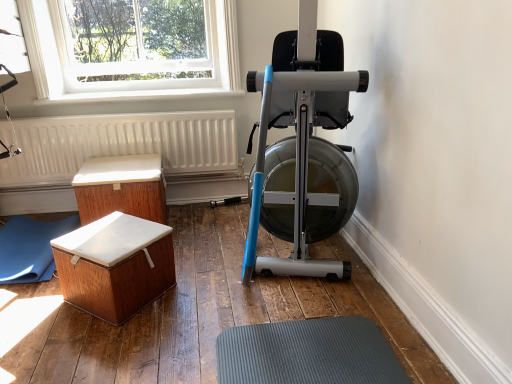
Question: Does wooden chest at lower left, which ranks as the 1th furniture in front-to-back order, come behind silver metallic stationary bicycle at center?

Choices:
 (A) no
 (B) yes

Answer: (B)

Question: Does wooden chest at lower left, which ranks as the 1th furniture in front-to-back order, have a greater width compared to silver metallic stationary bicycle at center?

Choices:
 (A) yes
 (B) no

Answer: (B)

Question: From the image's perspective, is wooden chest at lower left, marked as the 2th furniture in a back-to-front arrangement, on top of silver metallic stationary bicycle at center?

Choices:
 (A) no
 (B) yes

Answer: (A)

Question: Considering the relative positions of wooden chest at lower left, which ranks as the 1th furniture in front-to-back order, and silver metallic stationary bicycle at center in the image provided, is wooden chest at lower left, which ranks as the 1th furniture in front-to-back order, to the left of silver metallic stationary bicycle at center from the viewer's perspective?

Choices:
 (A) no
 (B) yes

Answer: (B)

Question: Can you confirm if wooden chest at lower left, which ranks as the 1th furniture in front-to-back order, is smaller than silver metallic stationary bicycle at center?

Choices:
 (A) yes
 (B) no

Answer: (A)

Question: From their relative heights in the image, would you say wooden chest at lower left, which ranks as the 1th furniture in front-to-back order, is taller or shorter than white textured radiator at lower left?

Choices:
 (A) short
 (B) tall

Answer: (A)

Question: Relative to white textured radiator at lower left, is wooden chest at lower left, marked as the 2th furniture in a back-to-front arrangement, in front or behind?

Choices:
 (A) front
 (B) behind

Answer: (A)

Question: Is wooden chest at lower left, which ranks as the 1th furniture in front-to-back order, bigger or smaller than white textured radiator at lower left?

Choices:
 (A) big
 (B) small

Answer: (B)

Question: From the image's perspective, is wooden chest at lower left, marked as the 2th furniture in a back-to-front arrangement, located above or below white textured radiator at lower left?

Choices:
 (A) below
 (B) above

Answer: (A)

Question: Is blue rubber yoga mat at lower left in front of or behind clear glass window at upper left in the image?

Choices:
 (A) front
 (B) behind

Answer: (A)

Question: From their relative heights in the image, would you say blue rubber yoga mat at lower left is taller or shorter than clear glass window at upper left?

Choices:
 (A) tall
 (B) short

Answer: (B)

Question: Choose the correct answer: Is blue rubber yoga mat at lower left inside clear glass window at upper left or outside it?

Choices:
 (A) outside
 (B) inside

Answer: (A)

Question: From the image's perspective, is blue rubber yoga mat at lower left located above or below clear glass window at upper left?

Choices:
 (A) below
 (B) above

Answer: (A)

Question: Is white wood chest at lower left, placed as the 2th furniture when sorted from front to back, bigger or smaller than wooden chest at lower left, which ranks as the 1th furniture in front-to-back order?

Choices:
 (A) small
 (B) big

Answer: (B)

Question: From a real-world perspective, is white wood chest at lower left, placed as the 2th furniture when sorted from front to back, positioned above or below wooden chest at lower left, which ranks as the 1th furniture in front-to-back order?

Choices:
 (A) below
 (B) above

Answer: (B)